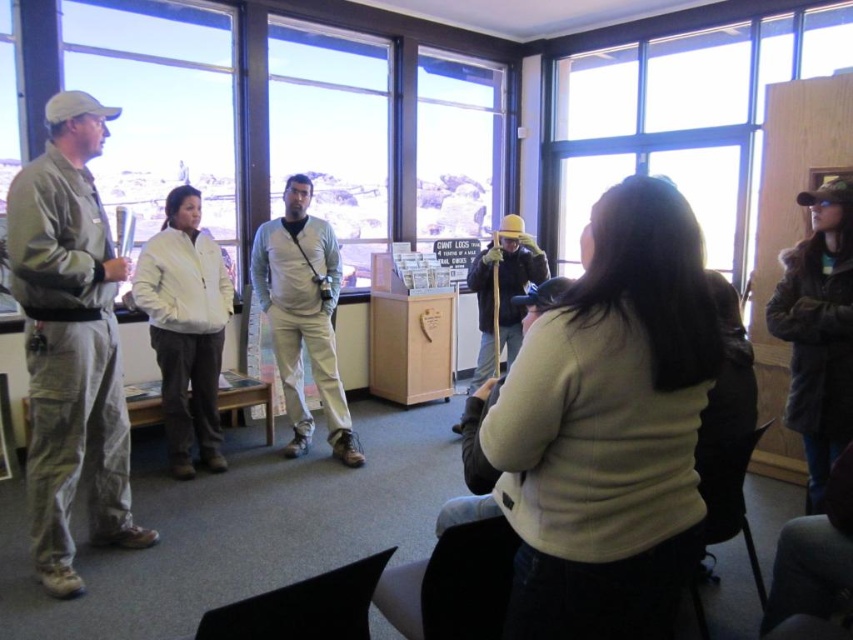
Question: Is clear glass window at upper left further to the viewer compared to transparent glass window at center?

Choices:
 (A) yes
 (B) no

Answer: (B)

Question: Which object appears closest to the camera in this image?

Choices:
 (A) transparent glass window at center
 (B) khaki cotton pants at left
 (C) light beige sweater at center
 (D) transparent glass window at upper center

Answer: (C)

Question: Is light gray cotton shirt at center in front of wooden stick at center?

Choices:
 (A) yes
 (B) no

Answer: (A)

Question: Which of the following is the closest to the observer?

Choices:
 (A) light beige sweater at center
 (B) clear glass window at upper left

Answer: (A)

Question: Which of the following is the closest to the observer?

Choices:
 (A) light beige sweater at center
 (B) white matte jacket at center
 (C) transparent glass window at upper center

Answer: (A)

Question: Can you confirm if clear glass window at upper left is wider than brown fuzzy coat at right?

Choices:
 (A) no
 (B) yes

Answer: (B)